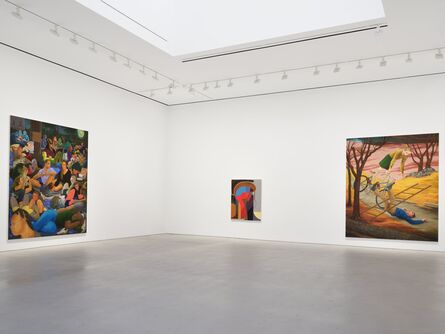
You are a GUI agent. You are given a task and a screenshot of the screen. Output one action in this format:
    pyautogui.click(x=<x>, y=<y>)
    Task: Click on the tray ceiling
    
    Given the screenshot: What is the action you would take?
    pyautogui.click(x=214, y=9)